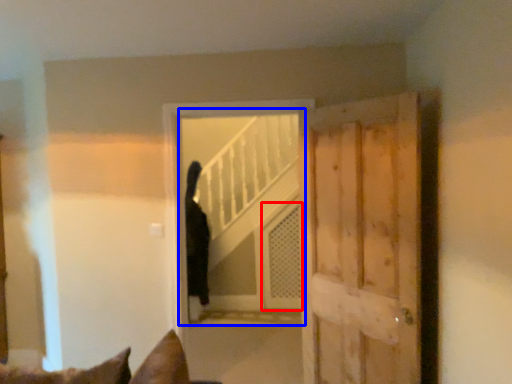
Question: Which point is further to the camera, screen door (highlighted by a red box) or elevator (highlighted by a blue box)?

Choices:
 (A) screen door
 (B) elevator

Answer: (A)